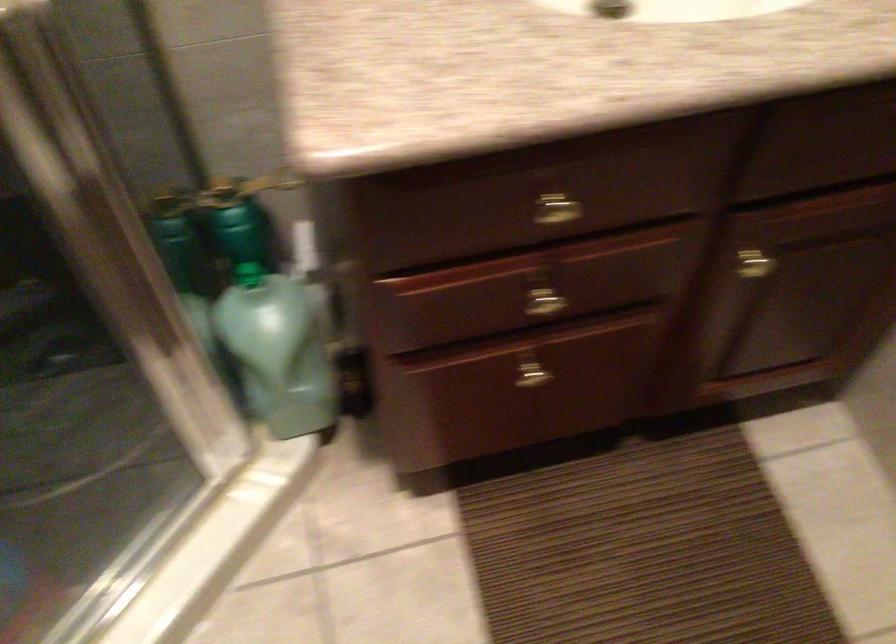
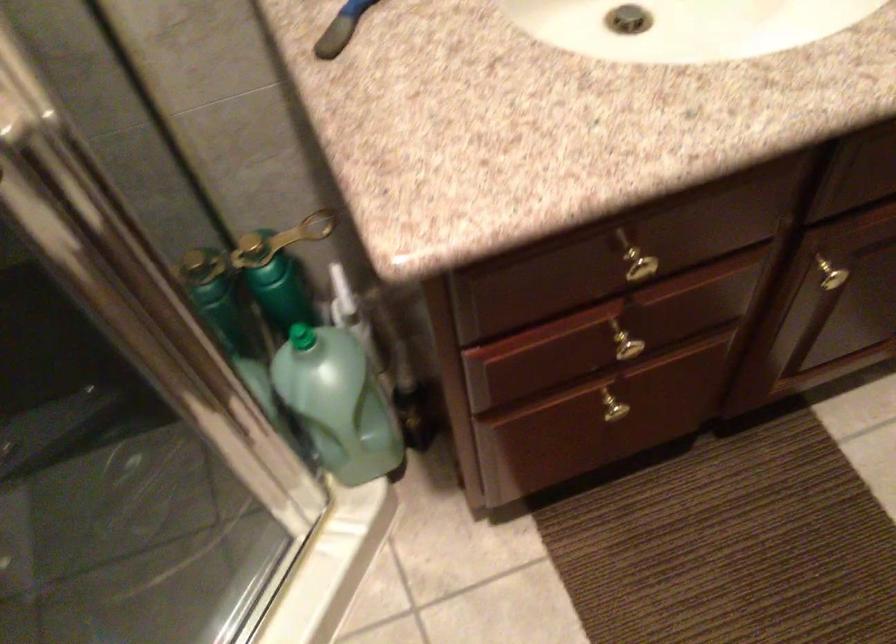
Find the pixel in the second image that matches the point at 245,276 in the first image.

(300, 337)